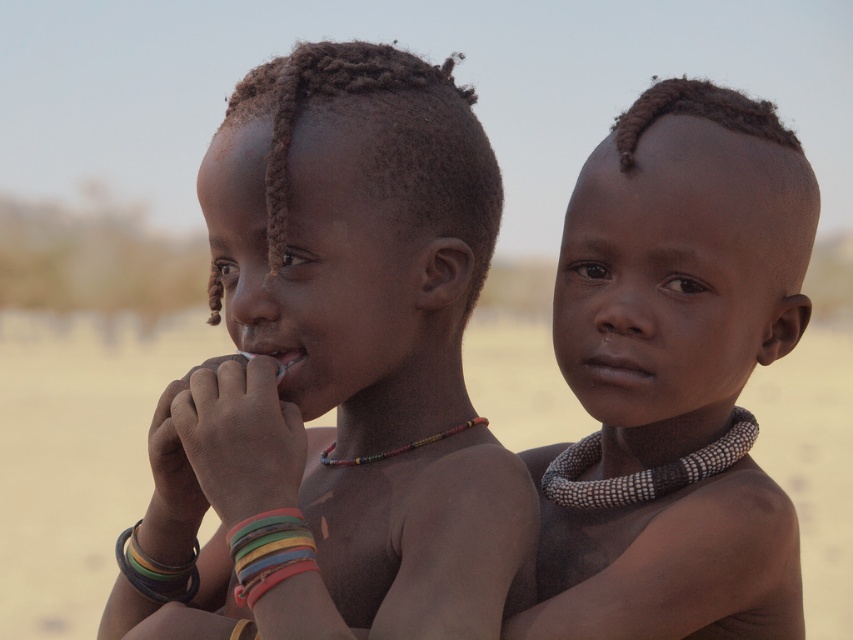
You are a photographer standing 2 meters away from the scene. You want to capture a closeup shot of the point at coordinates point (733, 170). Can you reach that point with your camera lens if your camera has a minimum focusing distance of 1.5 meters?

The distance of point (733, 170) from viewer is 1.49 meters, so the camera cannot focus on that point since the minimum focusing distance is 1.5 meters and the point is slightly closer than that.

You are a photographer trying to capture a closeup of the multicolored beaded necklace at center while also including the matte skin child at center in the frame. Based on their positions, which direction should you move your camera to the left or right to ensure both are in the shot?

Since the matte skin child at center is to the left of the multicolored beaded necklace at center, you should move your camera to the right to include both in the frame.

You are a photographer trying to capture the children in the desert scene. You notice the dry skin at center and the multicolored beaded necklace at center. Which object is positioned to the right side of the other?

The dry skin at center is positioned to the right of the multicolored beaded necklace at center.